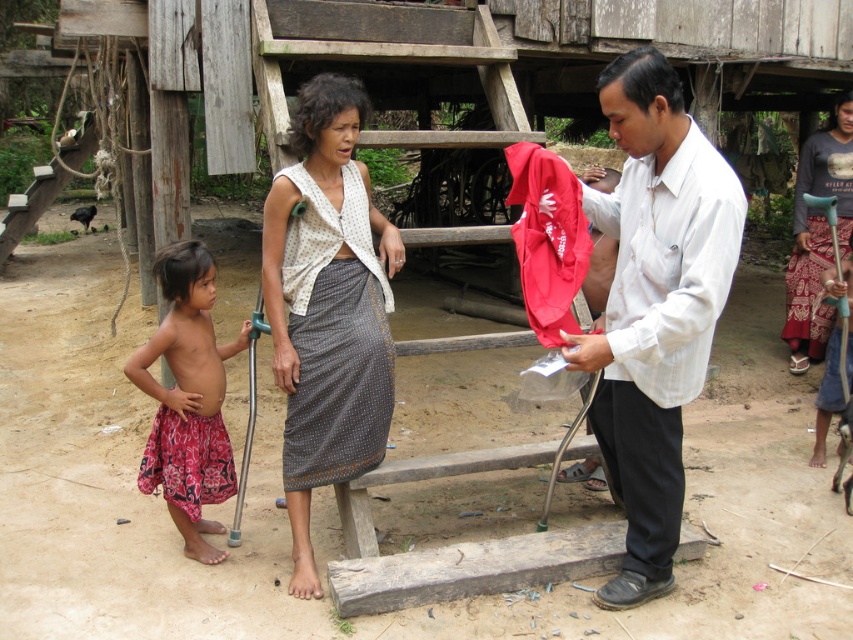
You are a visitor in this rural area and notice two skirts at the center of the image. Which one is positioned lower between the gray dotted fabric skirt at center and the gray printed skirt at center?

The gray dotted fabric skirt at center is positioned lower as it is below the gray printed skirt at center.